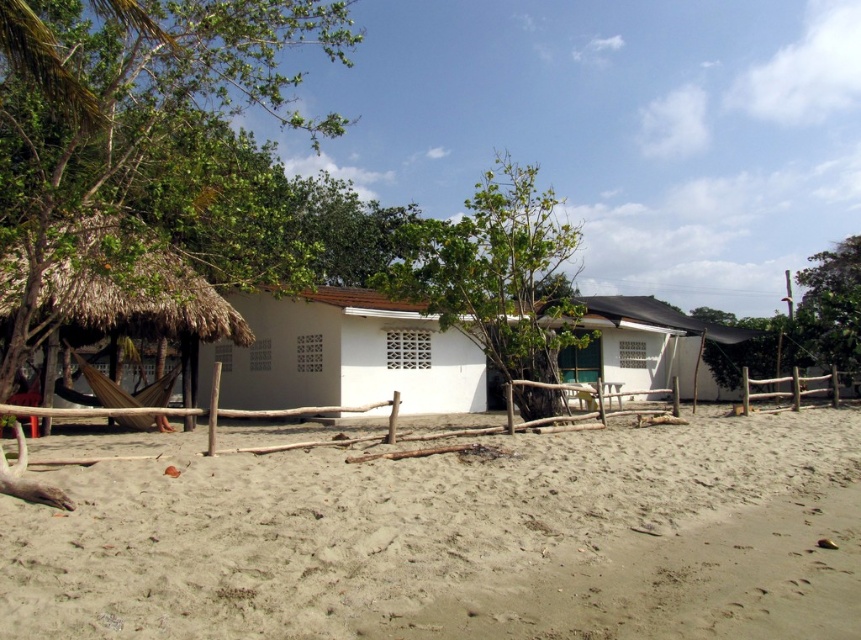
Question: Does thatched straw hut at left appear over green leafy tree at upper right?

Choices:
 (A) yes
 (B) no

Answer: (A)

Question: Which is farther from the light beige sand at lower center?

Choices:
 (A) green leafy tree at upper right
 (B) green leafy tree at center
 (C) green leafy tree at left

Answer: (A)

Question: Which is nearer to the thatched straw hut at left?

Choices:
 (A) light beige sand at lower center
 (B) green leafy tree at center

Answer: (A)

Question: Can you confirm if light beige sand at lower center is positioned below thatched straw hut at left?

Choices:
 (A) no
 (B) yes

Answer: (B)

Question: Is light beige sand at lower center closer to the viewer compared to green leafy tree at left?

Choices:
 (A) no
 (B) yes

Answer: (B)

Question: Which object is farther from the camera taking this photo?

Choices:
 (A) green leafy tree at upper right
 (B) light beige sand at lower center

Answer: (A)